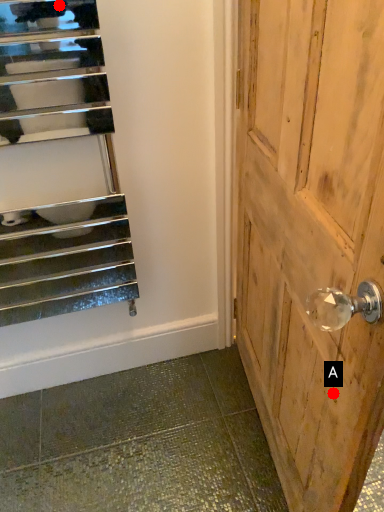
Question: Two points are circled on the image, labeled by A and B beside each circle. Which point is closer to the camera?

Choices:
 (A) A is closer
 (B) B is closer

Answer: (A)